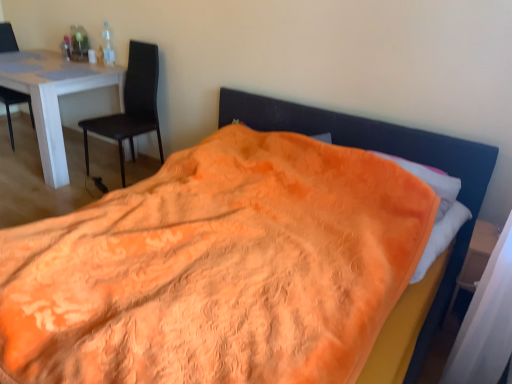
Question: In terms of height, does white glossy table at left look taller or shorter compared to matte black chair at left, which appears as the second chair when viewed from the left?

Choices:
 (A) tall
 (B) short

Answer: (B)

Question: Does point (67, 168) appear closer or farther from the camera than point (87, 173)?

Choices:
 (A) closer
 (B) farther

Answer: (A)

Question: Based on their relative distances, which object is nearer to the white glossy table at left?

Choices:
 (A) wooden at right
 (B) matte black chair at left, which is the 1th chair in left-to-right order
 (C) matte black chair at left, which appears as the second chair when viewed from the left

Answer: (C)

Question: Which object is the farthest from the wooden at right?

Choices:
 (A) matte black chair at left, which appears as the second chair when viewed from the left
 (B) matte black chair at left, placed as the 2th chair when sorted from right to left
 (C) white glossy table at left

Answer: (B)